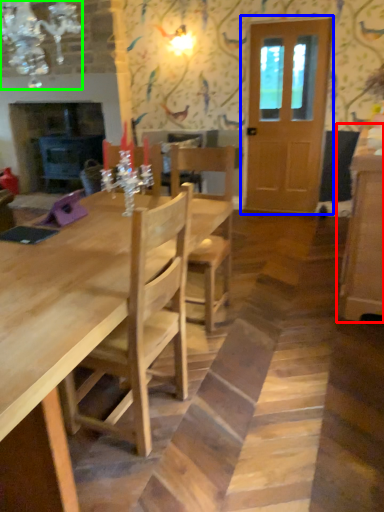
Question: Which object is the farthest from cabinetry (highlighted by a red box)? Choose among these: door (highlighted by a blue box) or light fixture (highlighted by a green box).

Choices:
 (A) door
 (B) light fixture

Answer: (B)